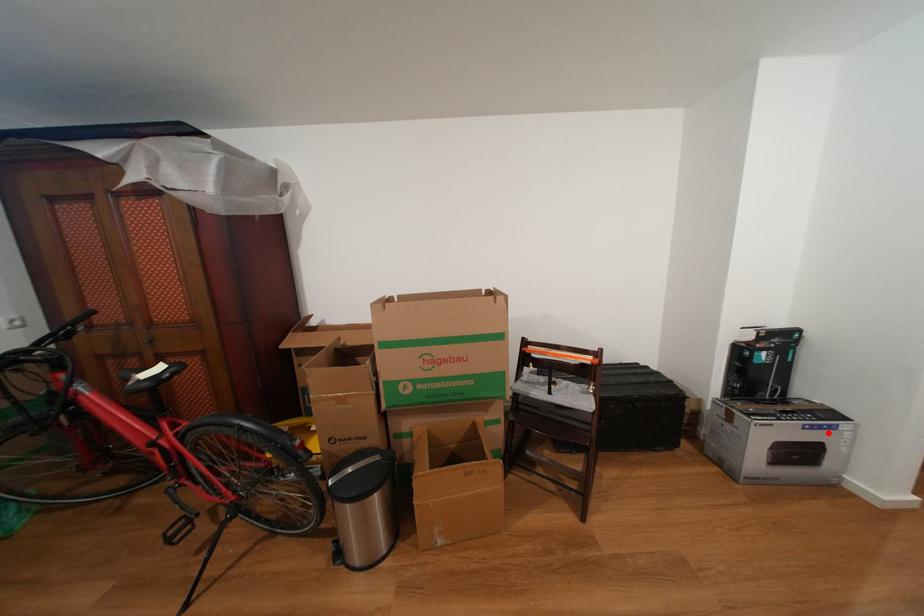
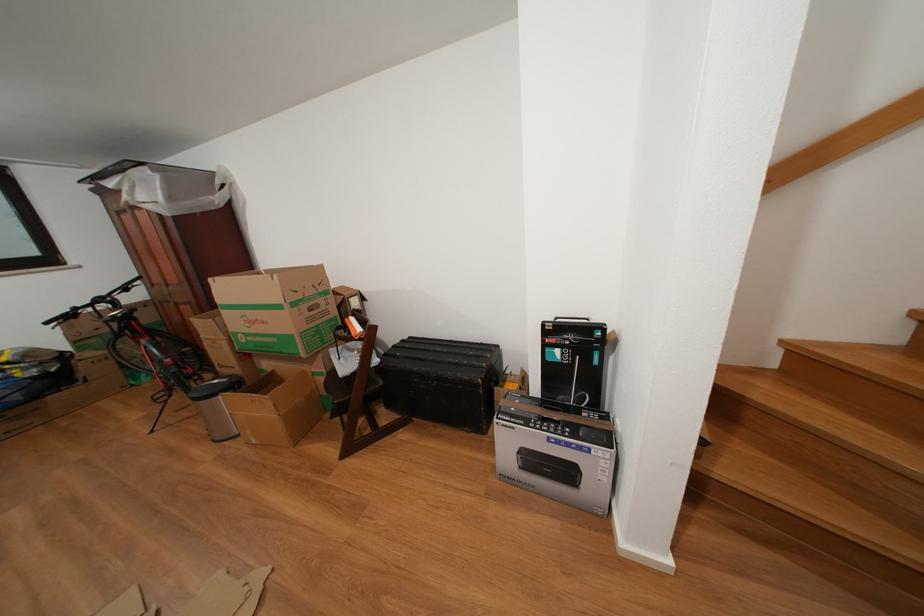
Question: I am providing you with two images of the same scene from different viewpoints. A red point is shown in image1. For the corresponding object point in image2, is it positioned nearer or farther from the camera?

Choices:
 (A) Nearer
 (B) Farther

Answer: (B)